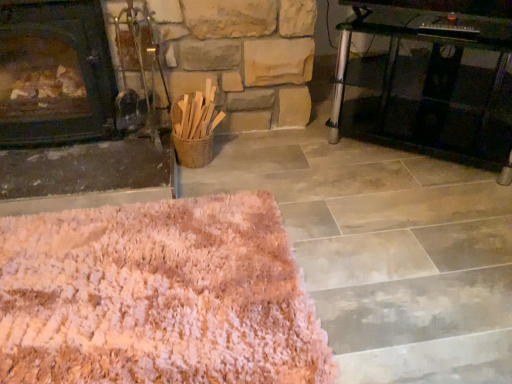
Question: Does pink shaggy rug at lower left come behind dark wood fireplace at left?

Choices:
 (A) no
 (B) yes

Answer: (A)

Question: Are pink shaggy rug at lower left and dark wood fireplace at left making contact?

Choices:
 (A) yes
 (B) no

Answer: (B)

Question: From the image's perspective, is pink shaggy rug at lower left under dark wood fireplace at left?

Choices:
 (A) no
 (B) yes

Answer: (B)

Question: Is pink shaggy rug at lower left positioned with its back to dark wood fireplace at left?

Choices:
 (A) yes
 (B) no

Answer: (B)

Question: Is pink shaggy rug at lower left closer to camera compared to dark wood fireplace at left?

Choices:
 (A) yes
 (B) no

Answer: (A)

Question: Looking at the image, does pink shaggy rug at lower left seem bigger or smaller compared to transparent glass table at right?

Choices:
 (A) small
 (B) big

Answer: (A)

Question: From the image's perspective, is pink shaggy rug at lower left positioned above or below transparent glass table at right?

Choices:
 (A) below
 (B) above

Answer: (A)

Question: From a real-world perspective, is pink shaggy rug at lower left positioned above or below transparent glass table at right?

Choices:
 (A) below
 (B) above

Answer: (A)

Question: Looking at their shapes, would you say pink shaggy rug at lower left is wider or thinner than transparent glass table at right?

Choices:
 (A) wide
 (B) thin

Answer: (A)

Question: Considering the positions of dark wood fireplace at left and transparent glass table at right in the image, is dark wood fireplace at left wider or thinner than transparent glass table at right?

Choices:
 (A) wide
 (B) thin

Answer: (A)

Question: Relative to transparent glass table at right, is dark wood fireplace at left in front or behind?

Choices:
 (A) front
 (B) behind

Answer: (A)

Question: Considering the positions of point (83, 112) and point (384, 8), is point (83, 112) closer or farther from the camera than point (384, 8)?

Choices:
 (A) closer
 (B) farther

Answer: (A)

Question: Considering the positions of dark wood fireplace at left and transparent glass table at right in the image, is dark wood fireplace at left bigger or smaller than transparent glass table at right?

Choices:
 (A) small
 (B) big

Answer: (B)

Question: Does point (62, 92) appear closer or farther from the camera than point (222, 372)?

Choices:
 (A) farther
 (B) closer

Answer: (A)

Question: From a real-world perspective, is dark wood fireplace at left positioned above or below pink shaggy rug at lower left?

Choices:
 (A) above
 (B) below

Answer: (A)